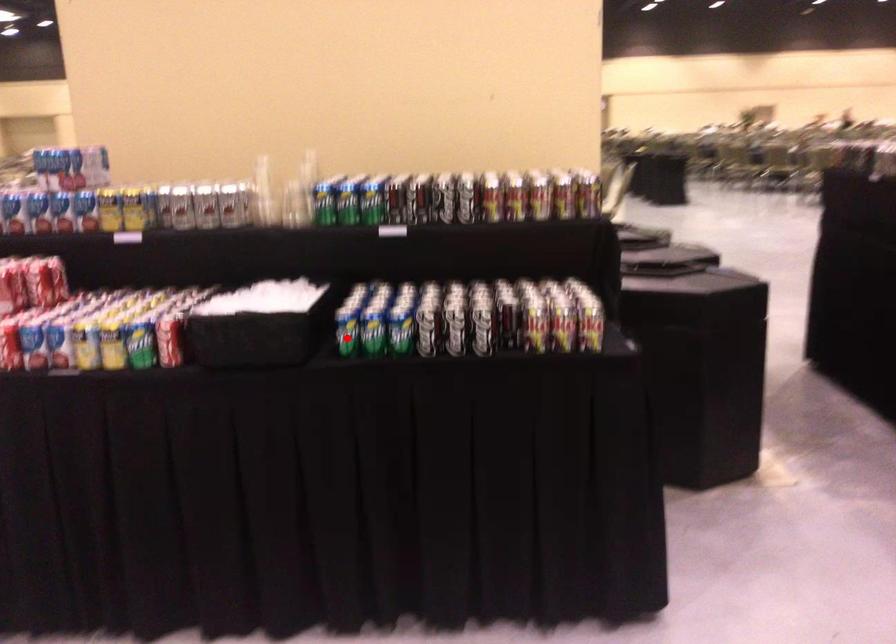
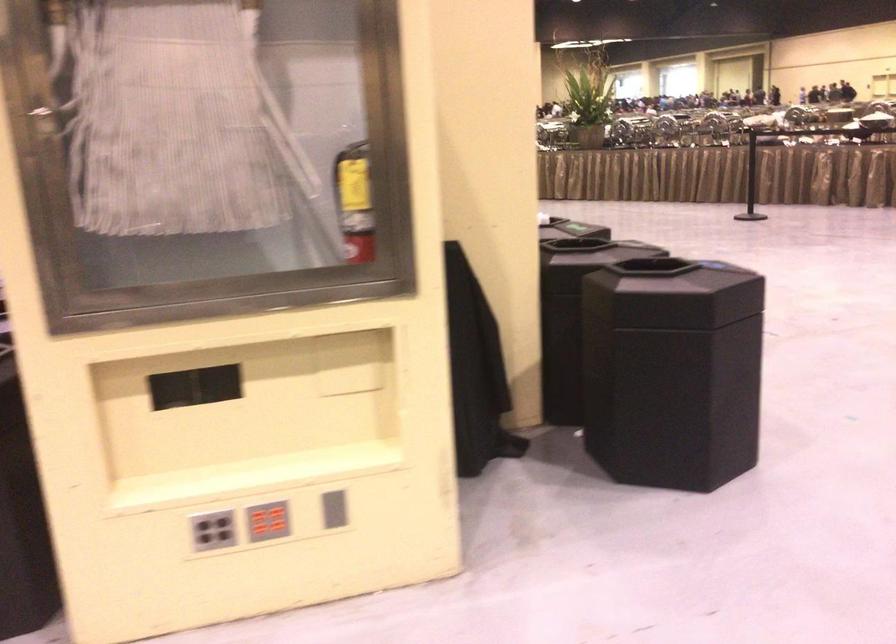
Question: I am providing you with two images of the same scene from different viewpoints. A red point is marked on the first image. Is the red point's position out of view in image 2?

Choices:
 (A) Yes
 (B) No

Answer: (A)